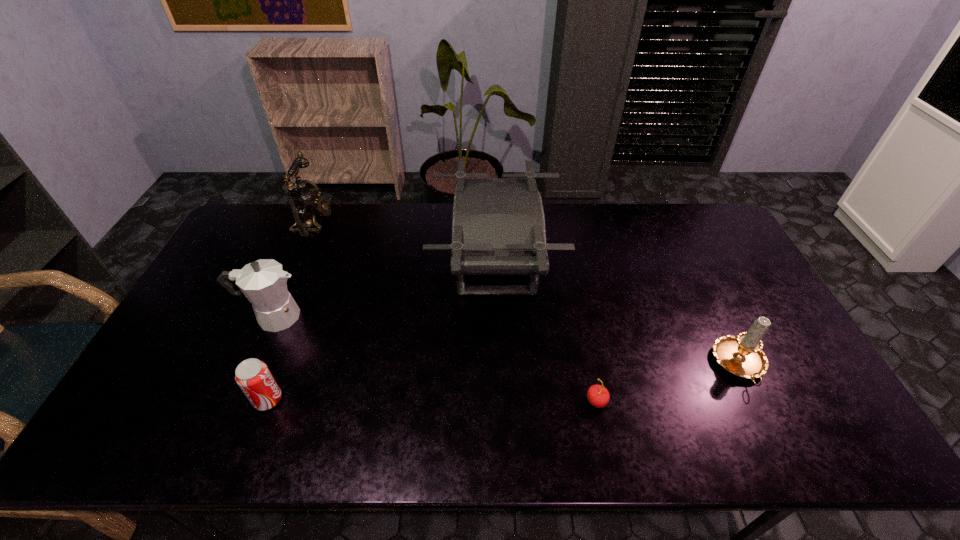
Locate an element on the screen. Image resolution: width=960 pixels, height=540 pixels. free space that satisfies the following two spatial constraints: 1. at the spout of the rightmost object; 2. on the left side of the coffeepot is located at coordinates (252, 366).